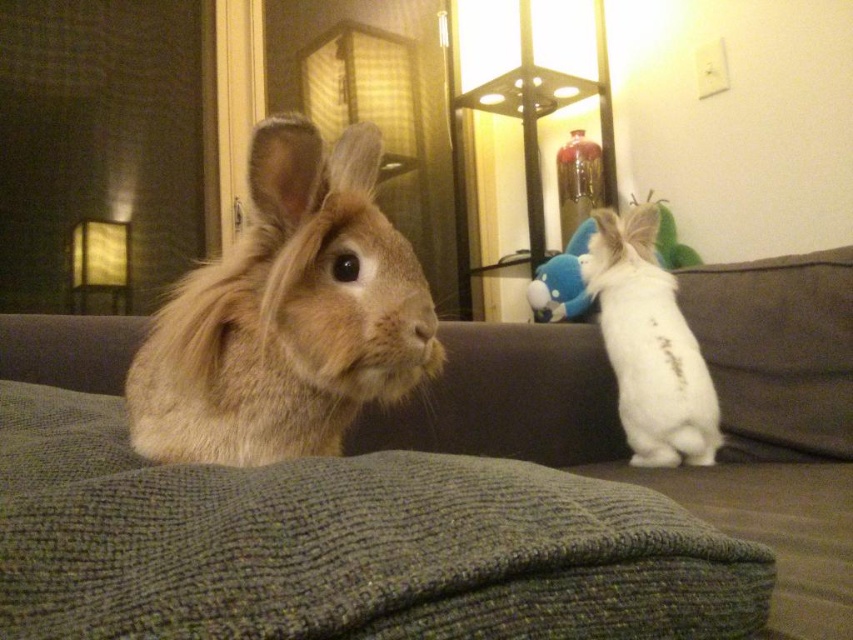
Is fuzzy beige rabbit at left below blue plush toy at right?

Yes.

Image resolution: width=853 pixels, height=640 pixels. Find the location of `fuzzy beige rabbit at left`. fuzzy beige rabbit at left is located at coordinates (287, 314).

Is green knitted couch at center to the right of white fluffy rabbit at right from the viewer's perspective?

No, green knitted couch at center is not to the right of white fluffy rabbit at right.

Who is higher up, green knitted couch at center or white fluffy rabbit at right?

white fluffy rabbit at right is higher up.

The image size is (853, 640). I want to click on green knitted couch at center, so click(x=721, y=417).

Does point (231, 445) come closer to viewer compared to point (598, 212)?

Yes.

Is fuzzy beige rabbit at left smaller than white fluffy rabbit at right?

Indeed, fuzzy beige rabbit at left has a smaller size compared to white fluffy rabbit at right.

You are a GUI agent. You are given a task and a screenshot of the screen. Output one action in this format:
    pyautogui.click(x=<x>, y=<y>)
    Task: Click on the fuzzy beige rabbit at left
    This screenshot has height=640, width=853.
    Given the screenshot: What is the action you would take?
    pyautogui.click(x=287, y=314)